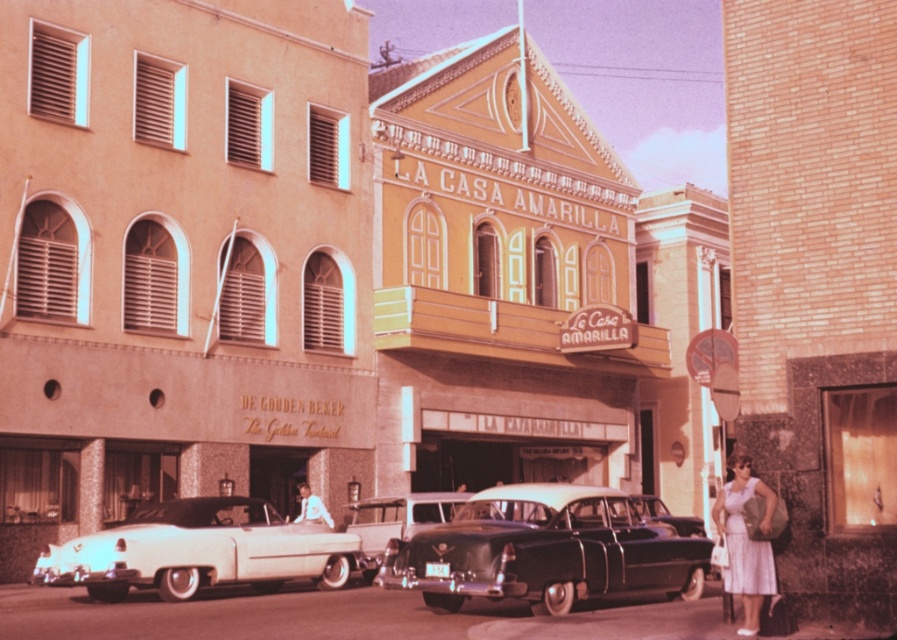
Which of these two, white glossy convertible at center or shiny silver sedan at center, stands taller?

With more height is shiny silver sedan at center.

Is white glossy convertible at center wider than shiny silver sedan at center?

No.

Find the location of `white glossy convertible at center`. white glossy convertible at center is located at coordinates (201, 550).

Based on the photo, between white glossy convertible at center and light blue shirt at center, which one is positioned lower?

white glossy convertible at center is below.

Between white glossy convertible at center and light blue shirt at center, which one is positioned higher?

light blue shirt at center is higher up.

Describe the element at coordinates (201, 550) in the screenshot. This screenshot has height=640, width=897. I see `white glossy convertible at center` at that location.

The height and width of the screenshot is (640, 897). Identify the location of white glossy convertible at center. (201, 550).

Where is `shiny silver sedan at center`? The image size is (897, 640). shiny silver sedan at center is located at coordinates click(x=398, y=518).

Is point (362, 528) positioned in front of point (311, 515)?

Yes, point (362, 528) is closer to viewer.

Which is in front, point (373, 531) or point (318, 513)?

Point (373, 531)

Where is `shiny silver sedan at center`? shiny silver sedan at center is located at coordinates (398, 518).